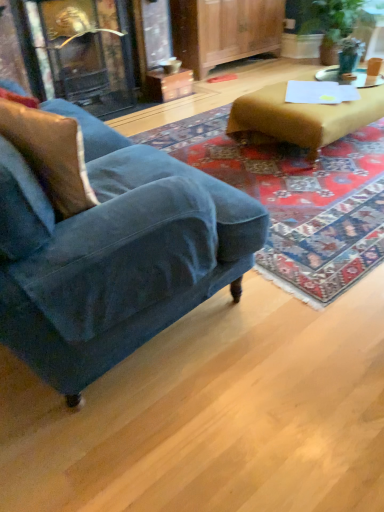
What do you see at coordinates (349, 54) in the screenshot?
I see `teal glass at upper right` at bounding box center [349, 54].

Measure the distance between point (324, 291) and camera.

Point (324, 291) and camera are 1.65 meters apart.

Where is `velvet brown pillow at left`? velvet brown pillow at left is located at coordinates (50, 154).

The width and height of the screenshot is (384, 512). Identify the location of brown leather ottoman at upper right. [300, 118].

Image resolution: width=384 pixels, height=512 pixels. I want to click on white glossy side table at upper right, so click(x=349, y=79).

What do you see at coordinates (123, 259) in the screenshot?
I see `velvet blue couch at lower left` at bounding box center [123, 259].

Locate an element on the screen. teal glass at upper right is located at coordinates (349, 54).

From a real-world perspective, is velvet brown pillow at left physically located above or below velvet blue couch at lower left?

velvet brown pillow at left is situated higher than velvet blue couch at lower left in the real world.

In the image, there is a velvet brown pillow at left. Where is `studio couch below it (from a real-world perspective)`? Image resolution: width=384 pixels, height=512 pixels. studio couch below it (from a real-world perspective) is located at coordinates (123, 259).

Is velvet brown pillow at left oriented away from velvet blue couch at lower left?

That's right, velvet brown pillow at left is facing away from velvet blue couch at lower left.

Between velvet brown pillow at left and velvet blue couch at lower left, which one appears on the right side from the viewer's perspective?

velvet brown pillow at left is more to the right.

Choose the correct answer: Is velvet brown pillow at left inside teal glass at upper right or outside it?

velvet brown pillow at left is not inside teal glass at upper right, it's outside.

Between point (71, 141) and point (357, 42), which one is positioned in front?

The point (71, 141) is closer to the camera.

From a real-world perspective, who is located lower, velvet brown pillow at left or teal glass at upper right?

teal glass at upper right is physically lower.

Is point (4, 115) farther from camera compared to point (369, 82)?

No, it is not.

Is white glossy side table at upper right located within velvet brown pillow at left?

No, white glossy side table at upper right is not a part of velvet brown pillow at left.

Is velvet brown pillow at left with white glossy side table at upper right?

No, velvet brown pillow at left is not making contact with white glossy side table at upper right.

Does point (96, 339) come farther from viewer compared to point (288, 218)?

No, (96, 339) is closer to viewer.

In the image, there is a velvet blue couch at lower left. Where is `mat below it (from a real-world perspective)`? This screenshot has width=384, height=512. mat below it (from a real-world perspective) is located at coordinates (297, 199).

Which object is wider, velvet blue couch at lower left or velvet blue armchair at left?

velvet blue armchair at left is wider.

Is brown leather ottoman at upper right not inside velvet blue couch at lower left?

Yes, brown leather ottoman at upper right is located beyond the bounds of velvet blue couch at lower left.

From the image's perspective, is brown leather ottoman at upper right above or below velvet blue couch at lower left?

brown leather ottoman at upper right is above velvet blue couch at lower left.

From a real-world perspective, between brown leather ottoman at upper right and velvet blue couch at lower left, who is vertically lower?

In real-world perspective, brown leather ottoman at upper right is lower.

Which object is wider, brown leather ottoman at upper right or velvet blue couch at lower left?

With larger width is velvet blue couch at lower left.

Is velvet brown pillow at left oriented towards velvet blue armchair at left?

Yes, velvet brown pillow at left faces towards velvet blue armchair at left.

Locate an element on the screen. mat on the right of velvet brown pillow at left is located at coordinates (297, 199).

Is velvet brown pillow at left shorter than velvet blue armchair at left?

Incorrect, the height of velvet brown pillow at left does not fall short of that of velvet blue armchair at left.

How many degrees apart are the facing directions of teal glass at upper right and brown leather ottoman at upper right?

There is a 179-degree angle between the facing directions of teal glass at upper right and brown leather ottoman at upper right.

Considering the positions of objects teal glass at upper right and brown leather ottoman at upper right in the image provided, who is more to the left, teal glass at upper right or brown leather ottoman at upper right?

From the viewer's perspective, brown leather ottoman at upper right appears more on the left side.

Is teal glass at upper right thinner than brown leather ottoman at upper right?

Yes, teal glass at upper right is thinner than brown leather ottoman at upper right.

This screenshot has width=384, height=512. In the image, there is a brown leather ottoman at upper right. Identify the location of teal above it (from the image's perspective). (349, 54).

The height and width of the screenshot is (512, 384). In order to click on pillow behind the velvet blue couch at lower left in this screenshot , I will do `click(50, 154)`.

The width and height of the screenshot is (384, 512). In order to click on pillow in front of the teal glass at upper right in this screenshot , I will do `click(50, 154)`.

From the image, which object appears to be farther from velvet brown pillow at left, teal glass at upper right or velvet blue armchair at left?

teal glass at upper right.

Estimate the real-world distances between objects in this image. Which object is closer to brown leather ottoman at upper right, velvet brown pillow at left or velvet blue couch at lower left?

velvet blue couch at lower left lies closer to brown leather ottoman at upper right than the other object.

Looking at the image, which one is located closer to teal glass at upper right, brown leather ottoman at upper right or velvet brown pillow at left?

brown leather ottoman at upper right lies closer to teal glass at upper right than the other object.

Which object lies further to the anchor point velvet blue couch at lower left, teal glass at upper right or velvet brown pillow at left?

teal glass at upper right lies further to velvet blue couch at lower left than the other object.

Considering their positions, is brown leather ottoman at upper right positioned further to velvet brown pillow at left than velvet blue armchair at left?

brown leather ottoman at upper right lies further to velvet brown pillow at left than the other object.

From the image, which object appears to be nearer to velvet blue armchair at left, brown leather ottoman at upper right or velvet brown pillow at left?

brown leather ottoman at upper right is closer to velvet blue armchair at left.

Based on the photo, estimate the real-world distances between objects in this image. Which object is closer to brown leather ottoman at upper right, teal glass at upper right or velvet blue armchair at left?

The object closer to brown leather ottoman at upper right is velvet blue armchair at left.

Which object lies nearer to the anchor point velvet blue armchair at left, white glossy side table at upper right or velvet blue couch at lower left?

velvet blue couch at lower left lies closer to velvet blue armchair at left than the other object.

The width and height of the screenshot is (384, 512). What are the coordinates of `table between velvet blue couch at lower left and white glossy side table at upper right in the front-back direction` in the screenshot? It's located at (300, 118).

The width and height of the screenshot is (384, 512). I want to click on pillow positioned between velvet blue couch at lower left and teal glass at upper right from near to far, so coord(50,154).

This screenshot has width=384, height=512. Identify the location of table located between velvet blue couch at lower left and teal glass at upper right in the depth direction. (300, 118).

What are the coordinates of `mat between velvet blue couch at lower left and teal glass at upper right in the front-back direction` in the screenshot? It's located at (297, 199).